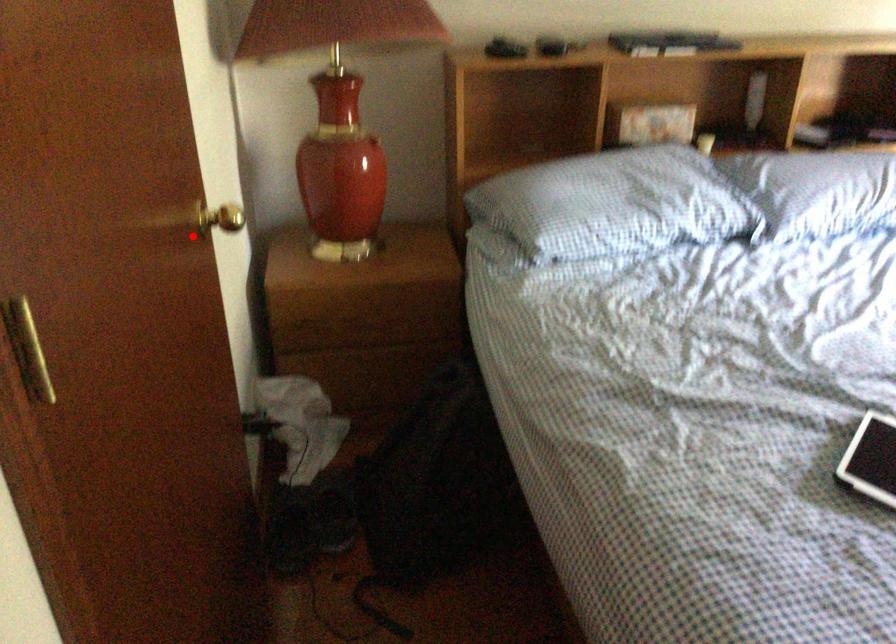
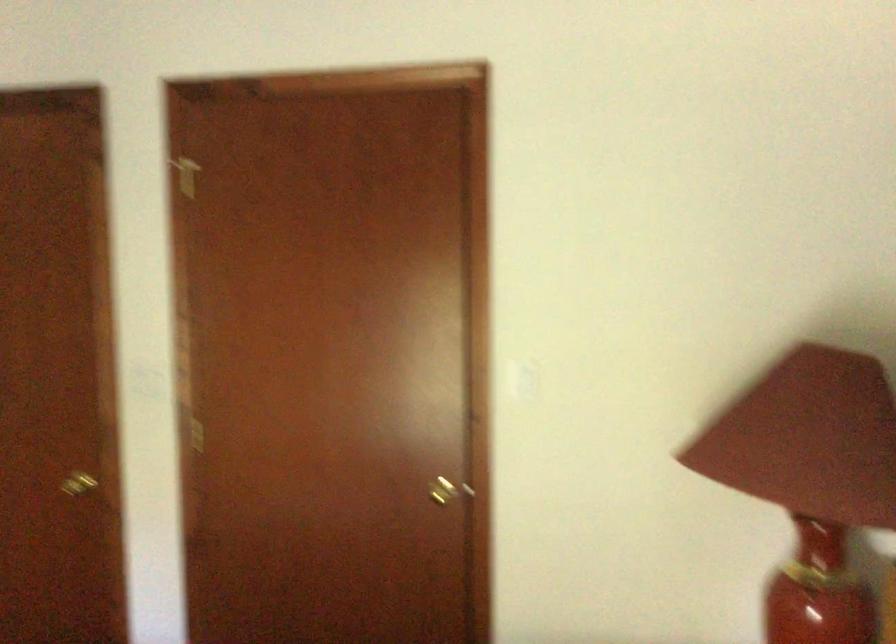
Question: A red point is marked in image1. In image2, is the corresponding 3D point closer to the camera or farther? Reply with the corresponding letter.

Choices:
 (A) The corresponding 3D point is closer.
 (B) The corresponding 3D point is farther.

Answer: (B)